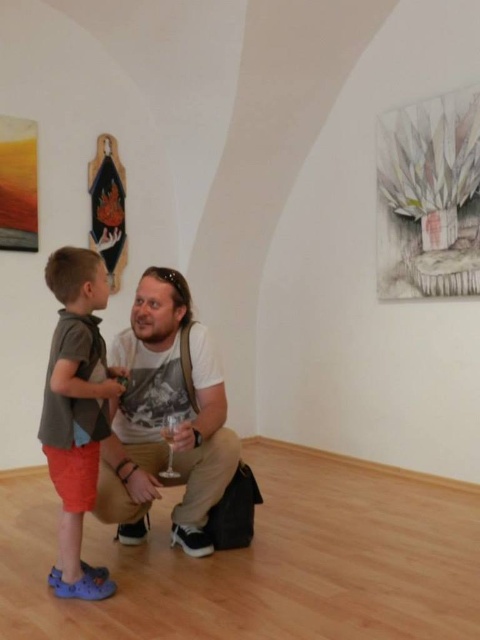
Question: Can you confirm if white cotton t-shirt at center is wider than matte gray shirt at left?

Choices:
 (A) yes
 (B) no

Answer: (A)

Question: Is white cotton t-shirt at center closer to the viewer compared to matte gray shirt at left?

Choices:
 (A) no
 (B) yes

Answer: (A)

Question: Is white cotton t-shirt at center to the left of matte gray shirt at left from the viewer's perspective?

Choices:
 (A) no
 (B) yes

Answer: (A)

Question: Among these points, which one is nearest to the camera?

Choices:
 (A) (156, 314)
 (B) (84, 449)

Answer: (B)